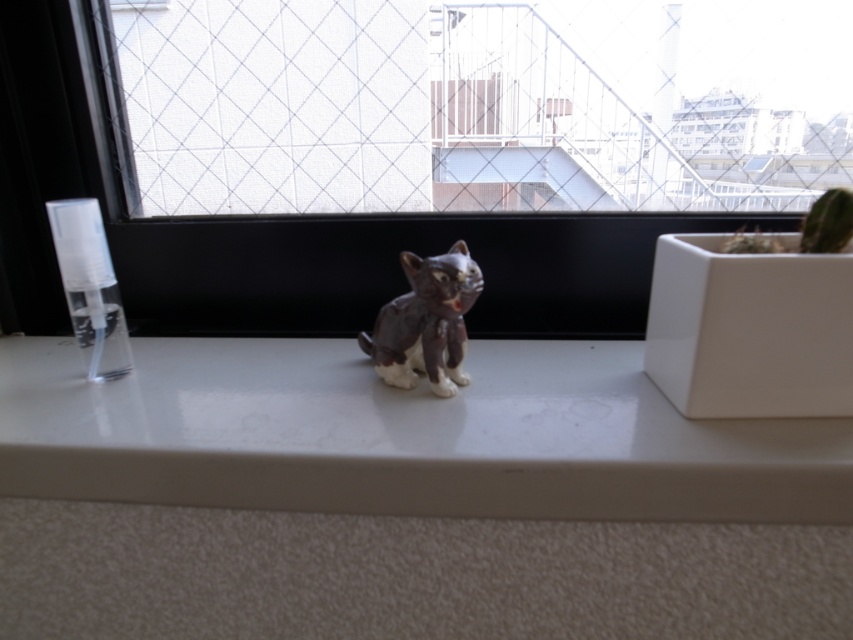
Question: Which point is closer to the camera?

Choices:
 (A) (531, 173)
 (B) (735, 477)
 (C) (416, 369)

Answer: (B)

Question: Is transparent mesh at center below matte brown cat at center?

Choices:
 (A) no
 (B) yes

Answer: (A)

Question: Which point is closer to the camera taking this photo?

Choices:
 (A) (422, 136)
 (B) (439, 273)

Answer: (B)

Question: Which object is the farthest from the matte brown cat at center?

Choices:
 (A) white glossy counter top at center
 (B) transparent mesh at center

Answer: (B)

Question: Does transparent mesh at center appear over matte brown cat at center?

Choices:
 (A) no
 (B) yes

Answer: (B)

Question: Is transparent mesh at center positioned at the back of matte brown cat at center?

Choices:
 (A) no
 (B) yes

Answer: (B)